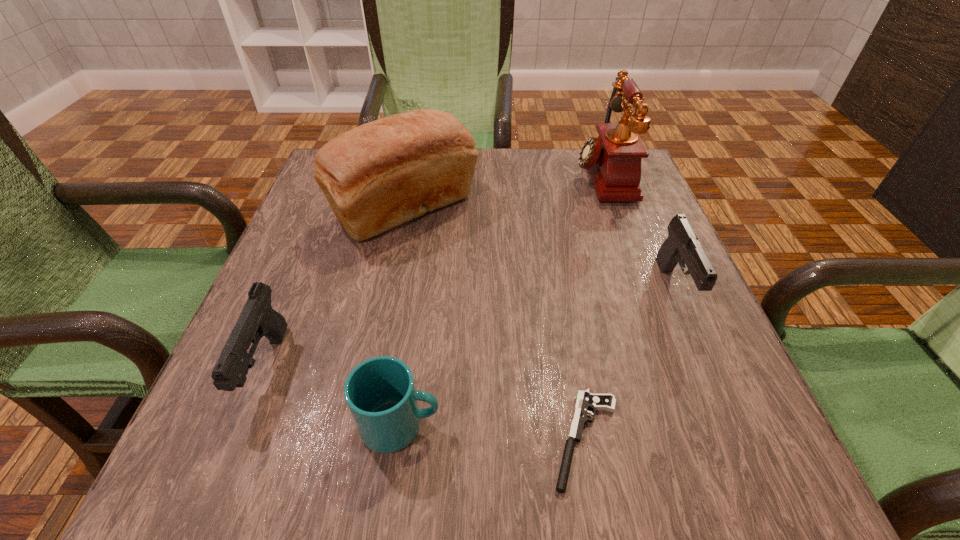
You are a GUI agent. You are given a task and a screenshot of the screen. Output one action in this format:
    pyautogui.click(x=<x>, y=<y>)
    Task: Click on the empty location between the cup and the telephone
    This screenshot has height=540, width=960.
    Given the screenshot: What is the action you would take?
    pyautogui.click(x=501, y=300)

Find the location of a particular element. The height and width of the screenshot is (540, 960). unoccupied position between the leftmost pistol and the cup is located at coordinates (333, 396).

Locate an element on the screen. This screenshot has height=540, width=960. free space between the telephone and the bread is located at coordinates (503, 193).

Identify the location of vacant area between the leftmost pistol and the cup. Image resolution: width=960 pixels, height=540 pixels. coord(333,396).

Identify which object is the second nearest to the farthest pistol. Please provide its 2D coordinates. Your answer should be formatted as a tuple, i.e. [(x, y)], where the tuple contains the x and y coordinates of a point satisfying the conditions above.

[(585, 400)]

This screenshot has height=540, width=960. I want to click on object that ranks as the closest to the telephone, so click(x=682, y=246).

Where is `pistol that is the closest to the cup`? This screenshot has height=540, width=960. pistol that is the closest to the cup is located at coordinates (585, 400).

The height and width of the screenshot is (540, 960). Find the location of `pistol that is the second closest to the cup`. pistol that is the second closest to the cup is located at coordinates (257, 319).

The height and width of the screenshot is (540, 960). What are the coordinates of `vacant position in the image that satisfies the following two spatial constraints: 1. on the dial of the telephone; 2. at the barrel of the leftmost pistol` in the screenshot? It's located at (669, 367).

I want to click on free space in the image that satisfies the following two spatial constraints: 1. aim along the barrel of the rightmost pistol; 2. on the front-facing side of the shortest object, so click(x=739, y=439).